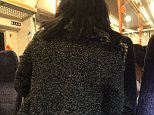
Mark all positions containing where you'd sit in the image. Your answer should be formatted as a list of tuples, i.e. [(x1, y1), (x2, y2), ...], where each tuple contains the x and y coordinates of a point satisfying the conditions above.

[(6, 83), (148, 93), (140, 55), (128, 64), (144, 48)]